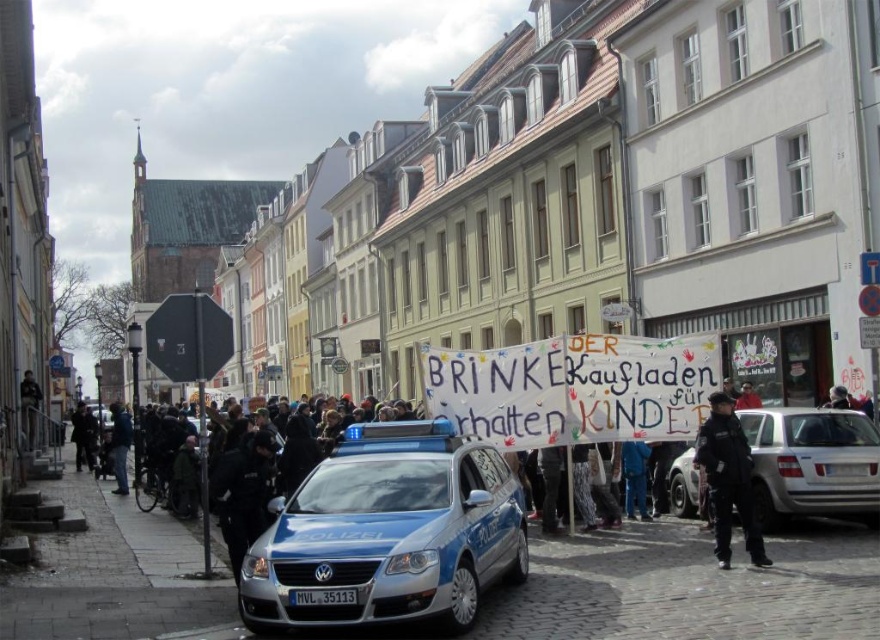
You are a tourist in this European town and you see a black uniform at center and a dark brown coat at lower left. Which clothing item is covering the other one?

The black uniform at center is positioned over dark brown coat at lower left, meaning it is covering the dark brown coat at lower left.

What is the significance of the point marked at coordinates (387, 532) in the image?

The point marked at coordinates (387, 532) indicates the location of the blue metallic police car at center.